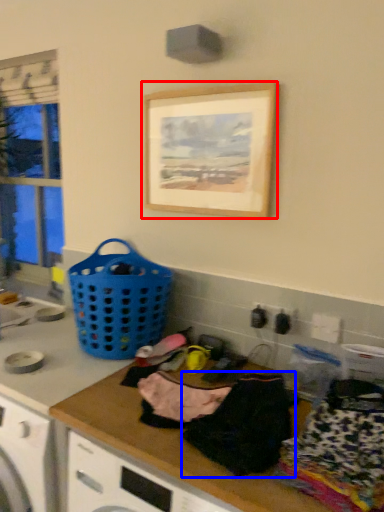
Question: Which of the following is the farthest to the observer, picture frame (highlighted by a red box) or clothing (highlighted by a blue box)?

Choices:
 (A) picture frame
 (B) clothing

Answer: (A)